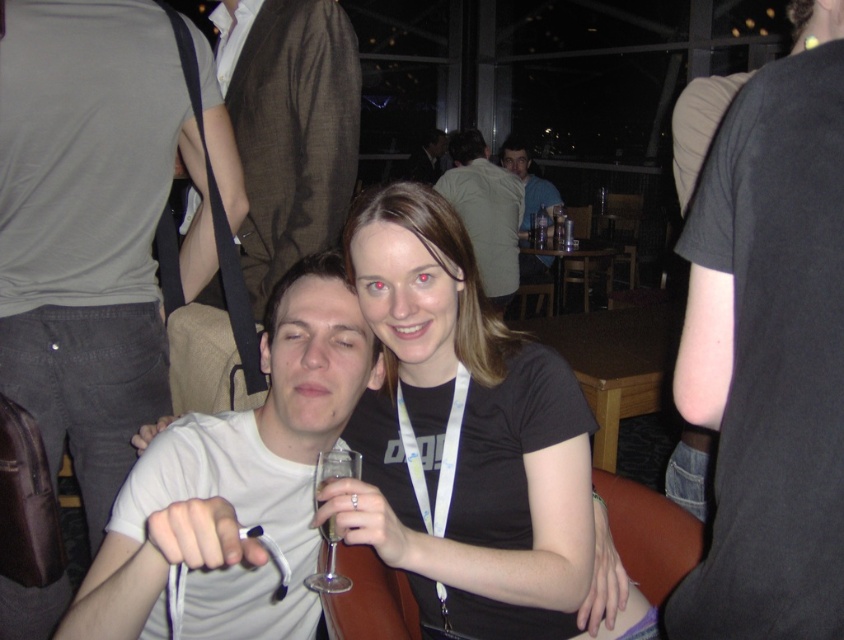
Which is more to the right, matte brown vest at upper center or clear glass wine at center?

Positioned to the right is clear glass wine at center.

Is the position of matte brown vest at upper center less distant than that of clear glass wine at center?

No, matte brown vest at upper center is behind clear glass wine at center.

Where is `matte brown vest at upper center`? This screenshot has height=640, width=844. matte brown vest at upper center is located at coordinates (426, 157).

The height and width of the screenshot is (640, 844). I want to click on matte brown vest at upper center, so click(426, 157).

Who is positioned more to the right, white matte t-shirt at center or transparent glass wine glass at center?

transparent glass wine glass at center

Is white matte t-shirt at center in front of transparent glass wine glass at center?

Yes.

Where is `white matte t-shirt at center`? white matte t-shirt at center is located at coordinates (235, 460).

Measure the distance between transparent glass wine glass at center and clear glass wine at center.

A distance of 1.91 centimeters exists between transparent glass wine glass at center and clear glass wine at center.

Does transparent glass wine glass at center have a greater height compared to clear glass wine at center?

Indeed, transparent glass wine glass at center has a greater height compared to clear glass wine at center.

Is point (336, 572) in front of point (333, 529)?

No.

Locate an element on the screen. The height and width of the screenshot is (640, 844). transparent glass wine glass at center is located at coordinates (328, 564).